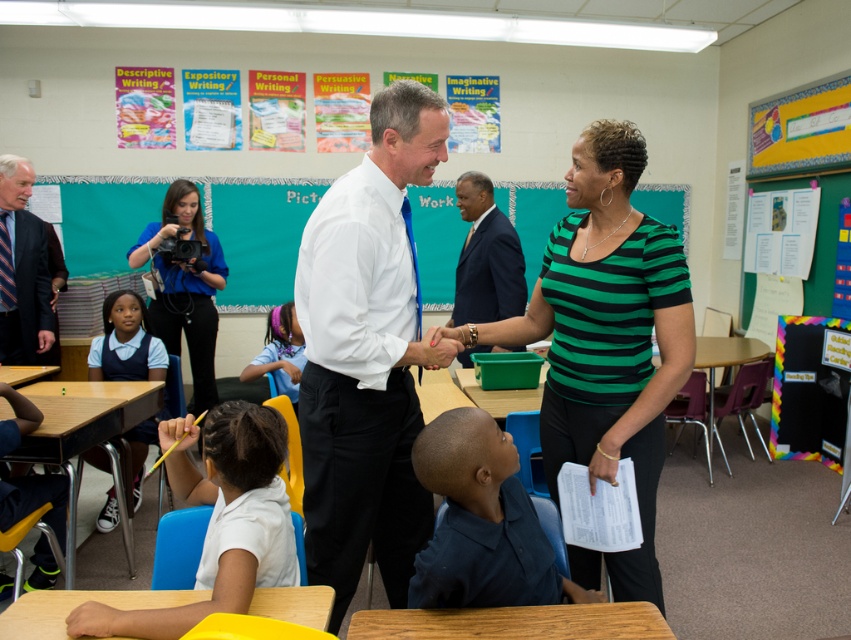
You are a student in the classroom and want to describe the positions of the dark blue suit at center and the purple shiny hairband at center. Which object is located to the right of the other?

The dark blue suit at center is to the right of the purple shiny hairband at center.

What is located at the coordinates point [606,336]?

The green striped shirt at center is located at point [606,336].

You are a photographer in the classroom and want to take a photo of both the green striped shirt at center and the white uniform at lower left. Which one should you focus on first if you want to capture both clearly in the frame?

The green striped shirt at center has a larger size compared to the white uniform at lower left, so you should focus on the green striped shirt at center first to ensure both are in focus.